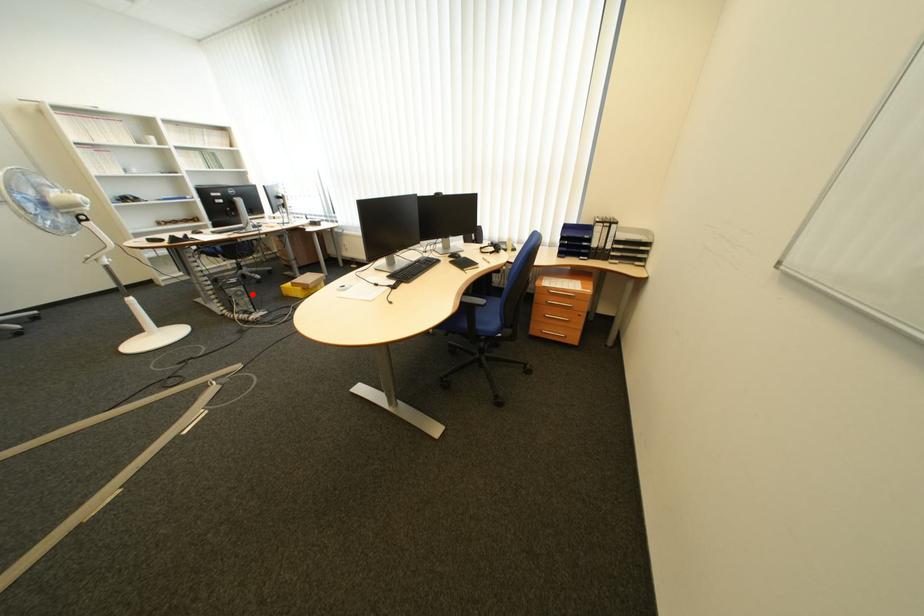
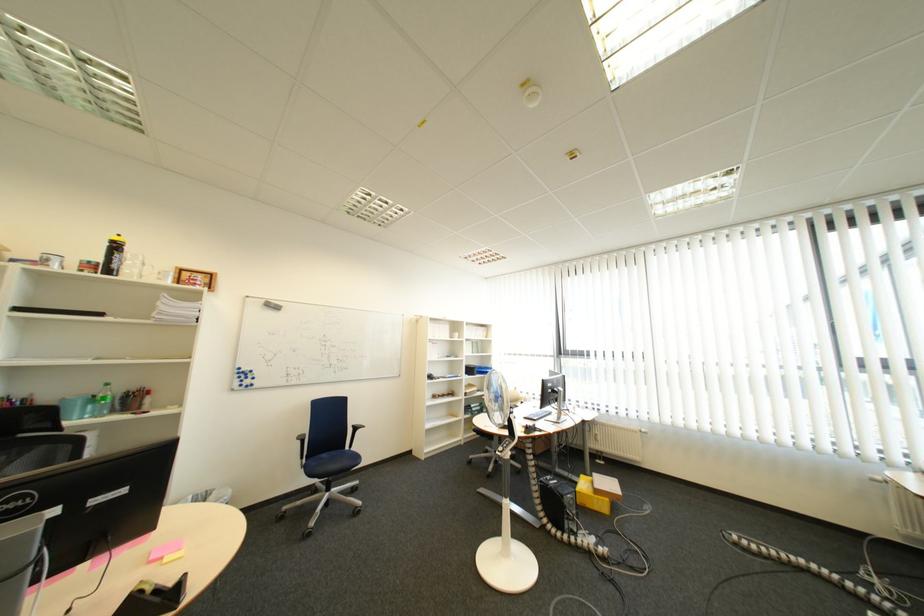
Question: I am providing you with two images of the same scene from different viewpoints. A red point is marked on the first image. At the location where the point appears in image 1, is it still visible in image 2?

Choices:
 (A) Yes
 (B) No

Answer: (A)